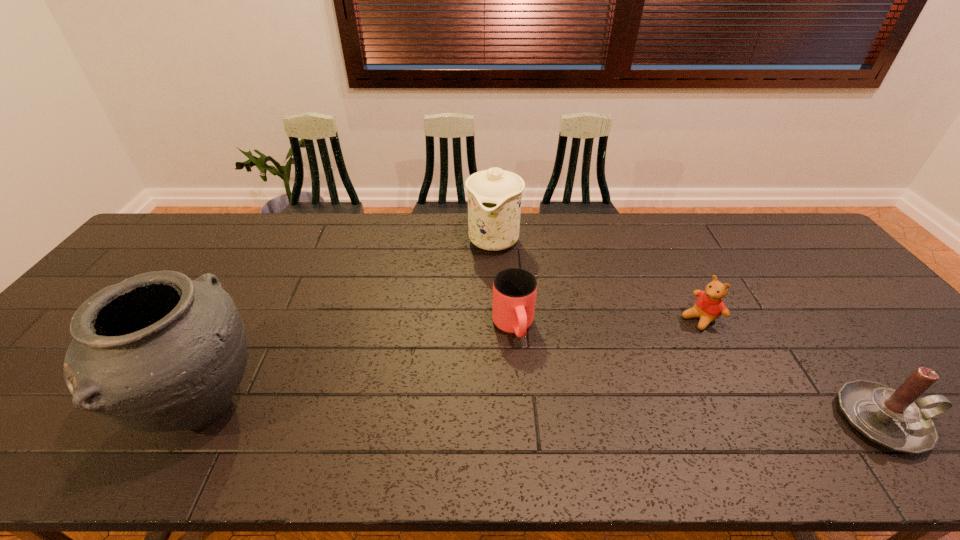
Identify the location of blank space at the right edge. Image resolution: width=960 pixels, height=540 pixels. tap(798, 261).

Locate an element on the screen. The width and height of the screenshot is (960, 540). vacant region between the fourth shortest object and the fourth object from left to right is located at coordinates (596, 278).

The width and height of the screenshot is (960, 540). I want to click on vacant region between the cup and the tallest object, so click(x=358, y=367).

Locate an element on the screen. The image size is (960, 540). free space between the leftmost object and the farthest object is located at coordinates (348, 323).

You are a GUI agent. You are given a task and a screenshot of the screen. Output one action in this format:
    pyautogui.click(x=<x>, y=<y>)
    Task: Click on the blank region between the chinaware and the second object from right to left
    This screenshot has width=960, height=540.
    Given the screenshot: What is the action you would take?
    coord(596,278)

Find the location of a particular element. free space between the teddy bear and the cup is located at coordinates (607, 322).

Where is `object that stands as the third closest to the second tallest object`? This screenshot has width=960, height=540. object that stands as the third closest to the second tallest object is located at coordinates (158, 352).

Identify which object is the third closest to the cup. Please provide its 2D coordinates. Your answer should be formatted as a tuple, i.e. [(x, y)], where the tuple contains the x and y coordinates of a point satisfying the conditions above.

[(158, 352)]

Where is `vacant space that satisfies the following two spatial constraints: 1. on the front side of the cup; 2. on the left side of the farthest object`? The width and height of the screenshot is (960, 540). vacant space that satisfies the following two spatial constraints: 1. on the front side of the cup; 2. on the left side of the farthest object is located at coordinates pos(497,327).

This screenshot has height=540, width=960. What are the coordinates of `free point that satisfies the following two spatial constraints: 1. on the back side of the urn; 2. on the left side of the cup` in the screenshot? It's located at (246, 327).